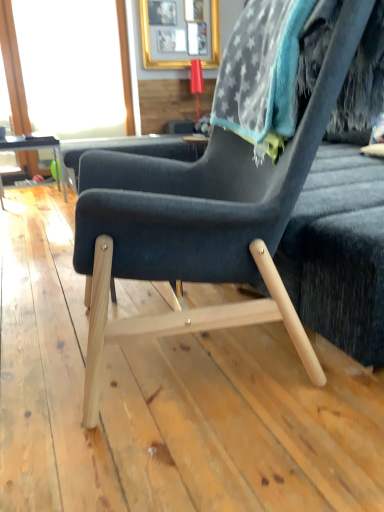
Question: Is transparent glass window screen at upper left further to the viewer compared to gold metallic picture frame at upper center?

Choices:
 (A) no
 (B) yes

Answer: (A)

Question: Is gold metallic picture frame at upper center located within transparent glass window screen at upper left?

Choices:
 (A) no
 (B) yes

Answer: (A)

Question: From the image's perspective, would you say transparent glass window screen at upper left is positioned over gold metallic picture frame at upper center?

Choices:
 (A) yes
 (B) no

Answer: (B)

Question: Can you confirm if transparent glass window screen at upper left is thinner than gold metallic picture frame at upper center?

Choices:
 (A) yes
 (B) no

Answer: (A)

Question: Is transparent glass window screen at upper left far away from gold metallic picture frame at upper center?

Choices:
 (A) no
 (B) yes

Answer: (A)

Question: Considering the relative sizes of transparent glass window screen at upper left and gold metallic picture frame at upper center in the image provided, is transparent glass window screen at upper left shorter than gold metallic picture frame at upper center?

Choices:
 (A) yes
 (B) no

Answer: (B)

Question: Does dark blue fabric chair at center appear on the left side of transparent glass window screen at upper left?

Choices:
 (A) yes
 (B) no

Answer: (B)

Question: Is transparent glass window screen at upper left a part of dark blue fabric chair at center?

Choices:
 (A) yes
 (B) no

Answer: (B)

Question: From a real-world perspective, is dark blue fabric chair at center beneath transparent glass window screen at upper left?

Choices:
 (A) no
 (B) yes

Answer: (B)

Question: Is dark blue fabric chair at center next to transparent glass window screen at upper left?

Choices:
 (A) yes
 (B) no

Answer: (B)

Question: From a real-world perspective, is dark blue fabric chair at center located higher than transparent glass window screen at upper left?

Choices:
 (A) yes
 (B) no

Answer: (B)

Question: Is dark blue fabric chair at center facing towards transparent glass window screen at upper left?

Choices:
 (A) yes
 (B) no

Answer: (B)

Question: Would you consider matte black table at left to be distant from dark blue fabric chair at center?

Choices:
 (A) yes
 (B) no

Answer: (A)